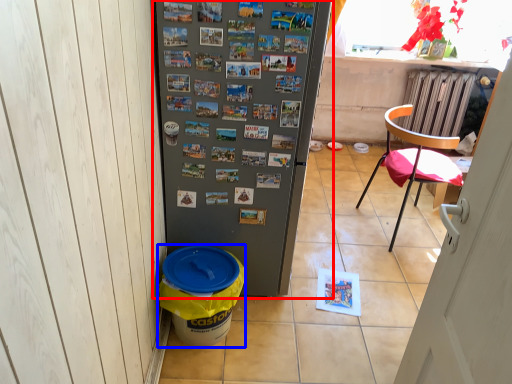
Question: Which object is closer to the camera taking this photo, refrigerator (highlighted by a red box) or recycling bin (highlighted by a blue box)?

Choices:
 (A) refrigerator
 (B) recycling bin

Answer: (A)